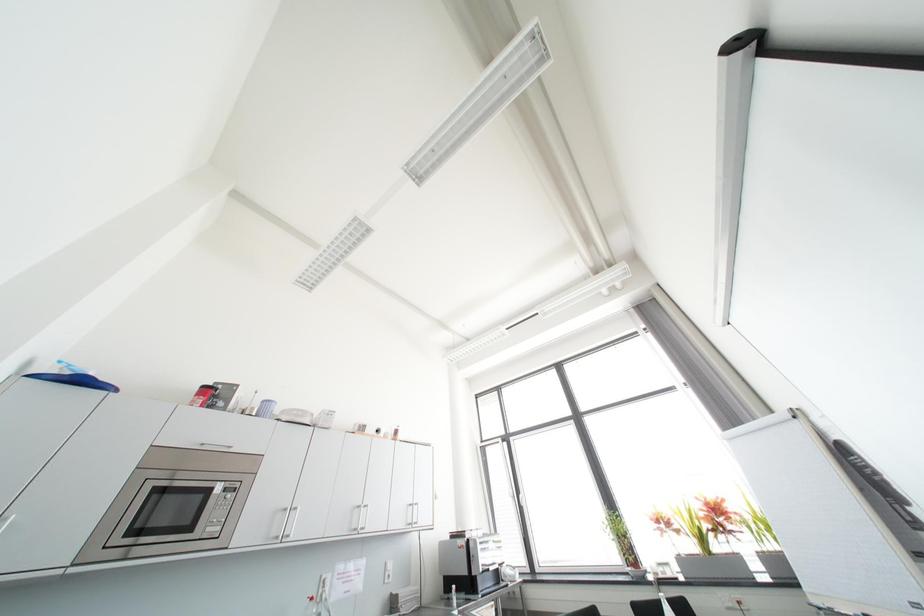
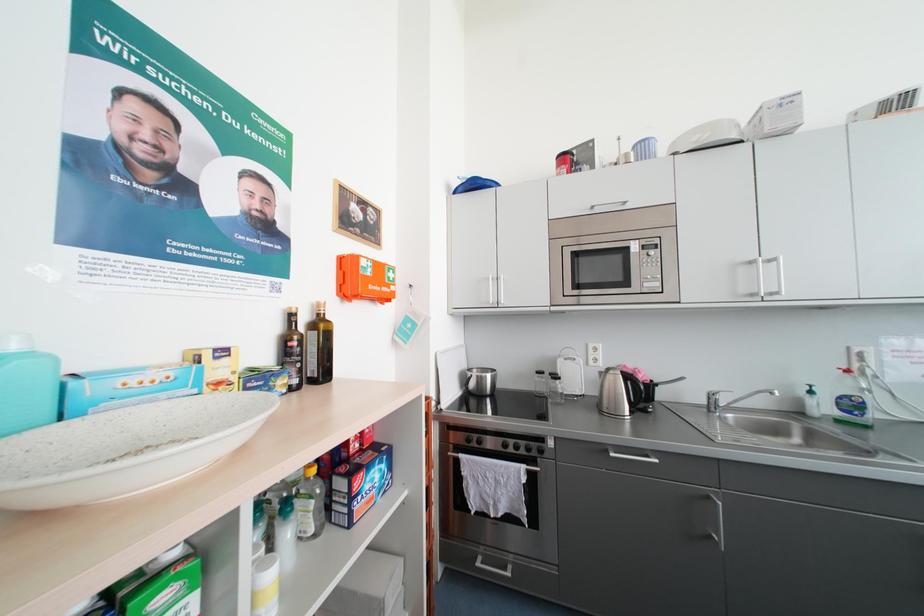
Question: The first image is from the beginning of the video and the second image is from the end. How did the camera likely rotate when shooting the video?

Choices:
 (A) Left
 (B) Right
 (C) Up
 (D) Down

Answer: (A)